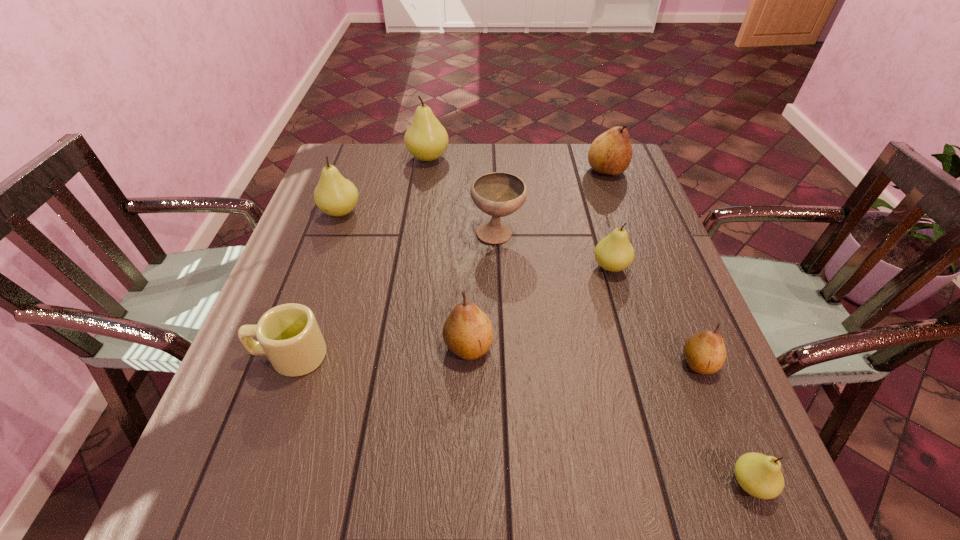
Image resolution: width=960 pixels, height=540 pixels. In order to click on vacant space located 0.330m on the back of the smallest brown pear in this screenshot , I will do `click(649, 239)`.

Identify the location of vacant space located on the back of the nearest green pear. (702, 363).

Where is `object present at the near edge`? The height and width of the screenshot is (540, 960). object present at the near edge is located at coordinates (759, 475).

What are the coordinates of `pear that is at the left edge` in the screenshot? It's located at (336, 196).

Locate an element on the screen. The image size is (960, 540). mug positioned at the left edge is located at coordinates (288, 334).

You are a GUI agent. You are given a task and a screenshot of the screen. Output one action in this format:
    pyautogui.click(x=<x>, y=<y>)
    Task: Click on the object present at the far right corner
    The width and height of the screenshot is (960, 540).
    Given the screenshot: What is the action you would take?
    pyautogui.click(x=611, y=152)

Where is `object that is at the near right corner`? The width and height of the screenshot is (960, 540). object that is at the near right corner is located at coordinates (759, 475).

Image resolution: width=960 pixels, height=540 pixels. Find the location of `free space at the far edge of the desktop`. free space at the far edge of the desktop is located at coordinates (425, 166).

In the image, there is a desktop. Where is `vacant space at the near edge`? The height and width of the screenshot is (540, 960). vacant space at the near edge is located at coordinates (364, 467).

At what (x,y) coordinates should I click in order to perform the action: click on vacant space at the left edge. Please return your answer as a coordinate pair (x, y). The width and height of the screenshot is (960, 540). Looking at the image, I should click on (307, 226).